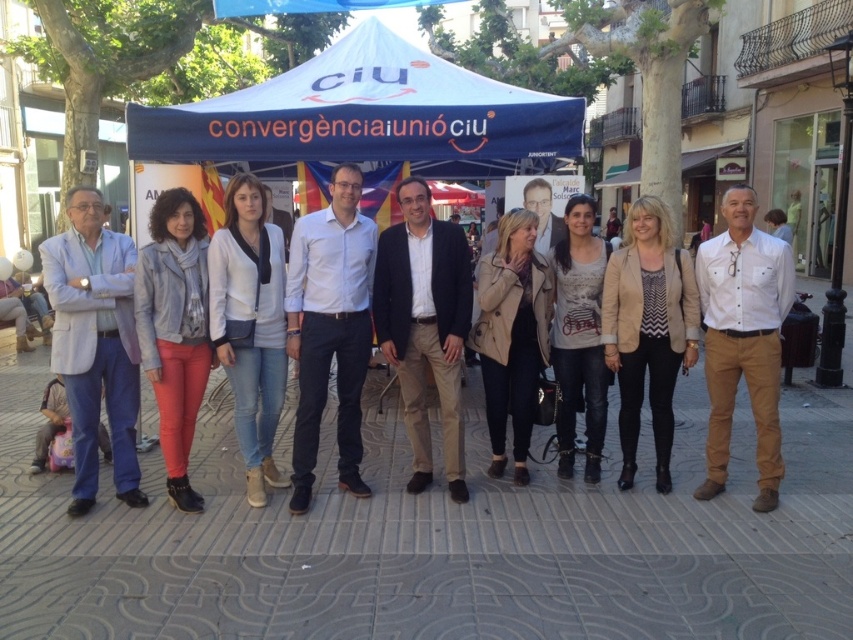
Does light brown cotton pants at center come in front of beige fabric coat at center?

Yes, light brown cotton pants at center is in front of beige fabric coat at center.

Does point (416, 291) come behind point (524, 394)?

No, it is not.

Who is more distant from viewer, (416, 472) or (498, 451)?

The point (498, 451) is behind.

You are a GUI agent. You are given a task and a screenshot of the screen. Output one action in this format:
    pyautogui.click(x=<x>, y=<y>)
    Task: Click on the light brown cotton pants at center
    
    Given the screenshot: What is the action you would take?
    pyautogui.click(x=424, y=324)

Is gray concrete pavement at center thinner than leather jacket at center?

In fact, gray concrete pavement at center might be wider than leather jacket at center.

Looking at this image, does gray concrete pavement at center appear under leather jacket at center?

Correct, gray concrete pavement at center is located below leather jacket at center.

Which is behind, point (532, 564) or point (144, 372)?

Positioned behind is point (144, 372).

The image size is (853, 640). Identify the location of gray concrete pavement at center. (437, 544).

Who is more forward, (67, 540) or (299, 458)?

Positioned in front is point (67, 540).

I want to click on gray concrete pavement at center, so click(x=437, y=544).